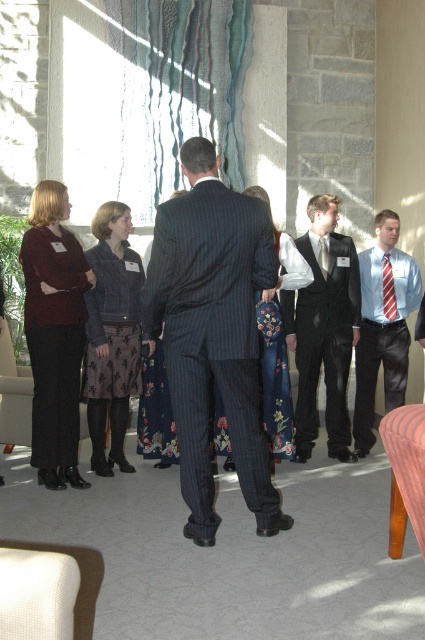
Is denim jacket at left below light blue shirt with tie at center?

Indeed, denim jacket at left is positioned under light blue shirt with tie at center.

Does denim jacket at left come behind light blue shirt with tie at center?

No, it is not.

Find the location of a particular element. Image resolution: width=425 pixels, height=640 pixels. denim jacket at left is located at coordinates click(112, 333).

Is light blue shirt with tie at center positioned at the back of red striped tie at center?

Yes, light blue shirt with tie at center is further from the viewer.

Who is higher up, light blue shirt with tie at center or red striped tie at center?

red striped tie at center

Measure the distance between light blue shirt with tie at center and camera.

16.73 feet

Identify the location of light blue shirt with tie at center. The image size is (425, 640). (382, 324).

Is matte burgundy sweater at left above floral fabric dress at center?

Indeed, matte burgundy sweater at left is positioned over floral fabric dress at center.

Does point (28, 321) lie in front of point (286, 376)?

That is True.

The image size is (425, 640). I want to click on matte burgundy sweater at left, so click(54, 332).